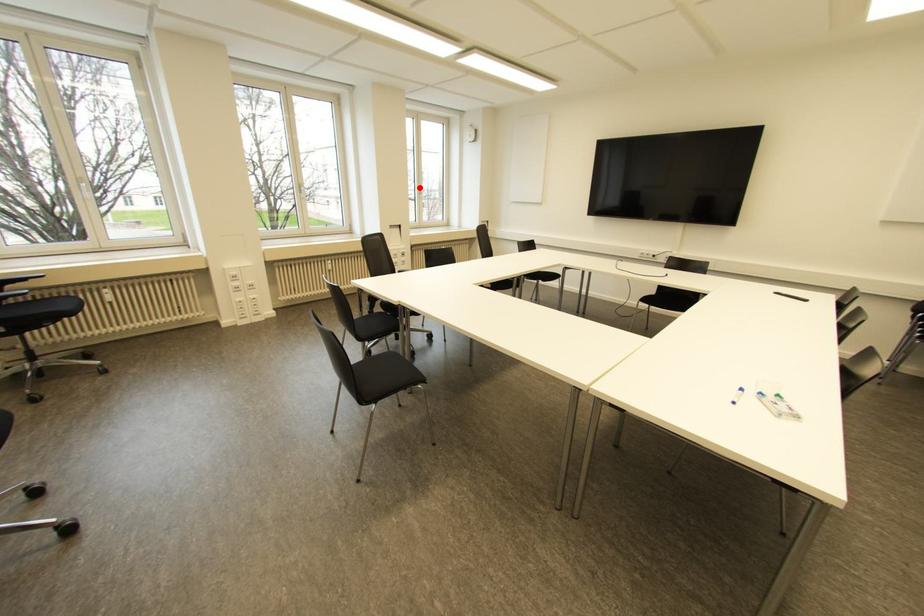
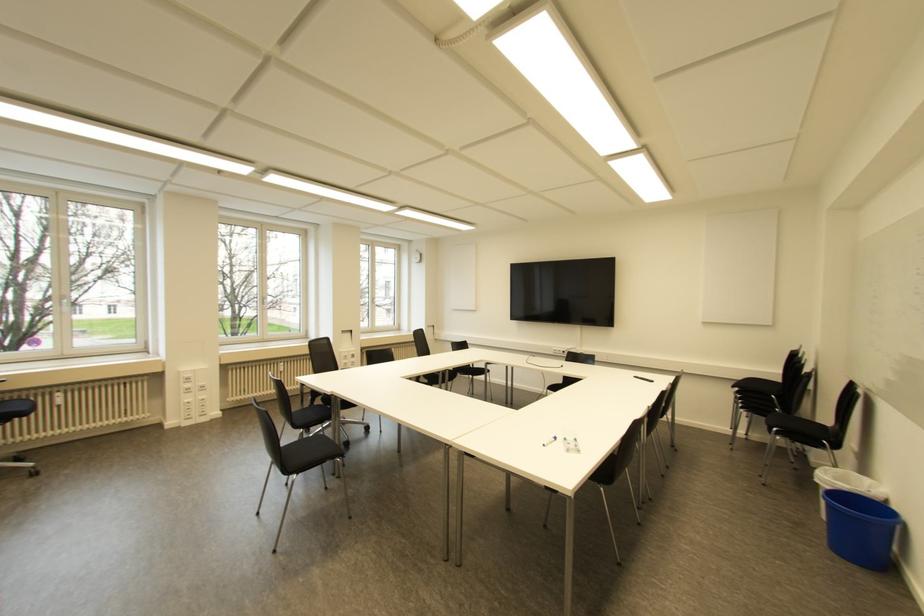
Question: I am providing you with two images of the same scene from different viewpoints. A red point is marked on the first image. At the location where the point appears in image 1, is it still visible in image 2?

Choices:
 (A) Yes
 (B) No

Answer: (A)